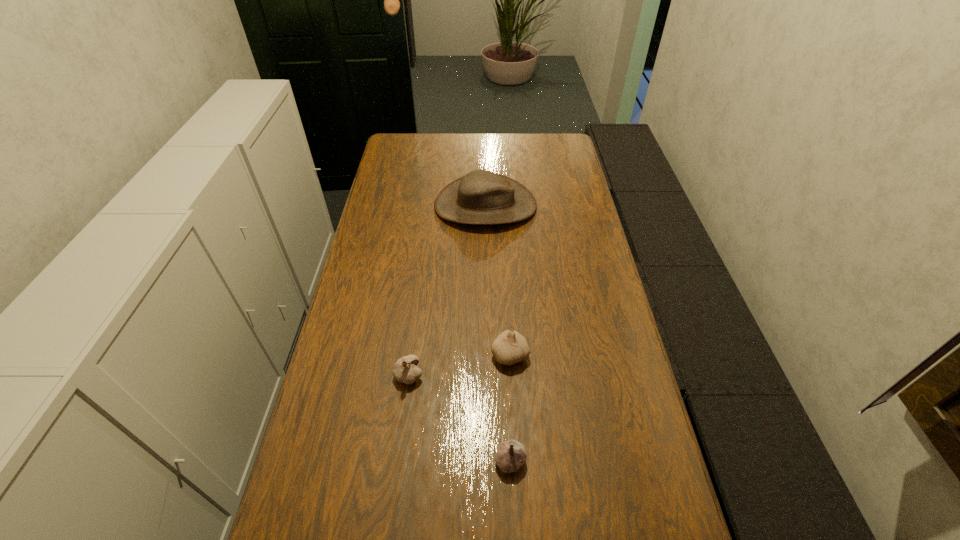
This screenshot has width=960, height=540. I want to click on free point that satisfies the following two spatial constraints: 1. on the front side of the tallest object; 2. on the right side of the nearest garlic, so click(489, 460).